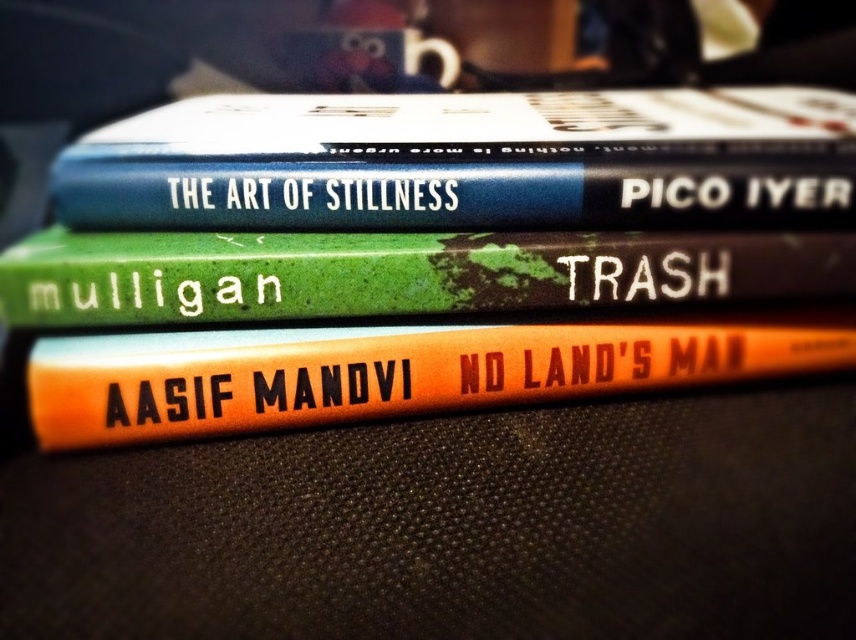
Who is more distant from viewer, (207, 172) or (181, 435)?

The point (181, 435) is behind.

Which is below, hardcover book at center or orange matte book at center?

orange matte book at center

What do you see at coordinates (467, 161) in the screenshot? The width and height of the screenshot is (856, 640). I see `hardcover book at center` at bounding box center [467, 161].

At what (x,y) coordinates should I click in order to perform the action: click on hardcover book at center. Please return your answer as a coordinate pair (x, y). This screenshot has height=640, width=856. Looking at the image, I should click on (467, 161).

Is point (845, 362) positioned in front of point (434, 298)?

No, (845, 362) is further to viewer.

Can you confirm if orange matte book at center is positioned below green matte book at center?

Yes, orange matte book at center is below green matte book at center.

Between point (73, 392) and point (235, 296), which one is positioned in front?

Point (73, 392) is in front.

Image resolution: width=856 pixels, height=640 pixels. In order to click on orange matte book at center in this screenshot , I will do `click(384, 371)`.

Which of these two, hardcover book at center or green matte book at center, stands taller?

hardcover book at center is taller.

Is the position of hardcover book at center more distant than that of green matte book at center?

Yes.

Does point (165, 189) come closer to viewer compared to point (200, 285)?

No, (165, 189) is behind (200, 285).

Locate an element on the screen. hardcover book at center is located at coordinates (467, 161).